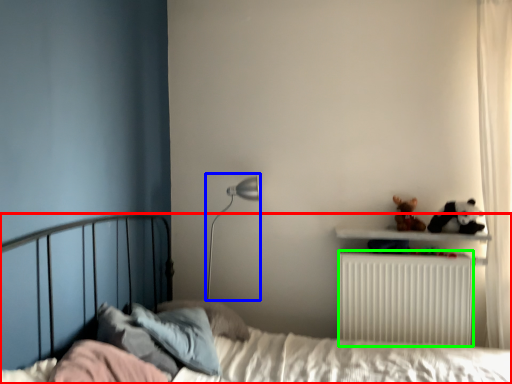
Question: Which object is the closest to the bed (highlighted by a red box)? Choose among these: table lamp (highlighted by a blue box) or radiator (highlighted by a green box).

Choices:
 (A) table lamp
 (B) radiator

Answer: (B)